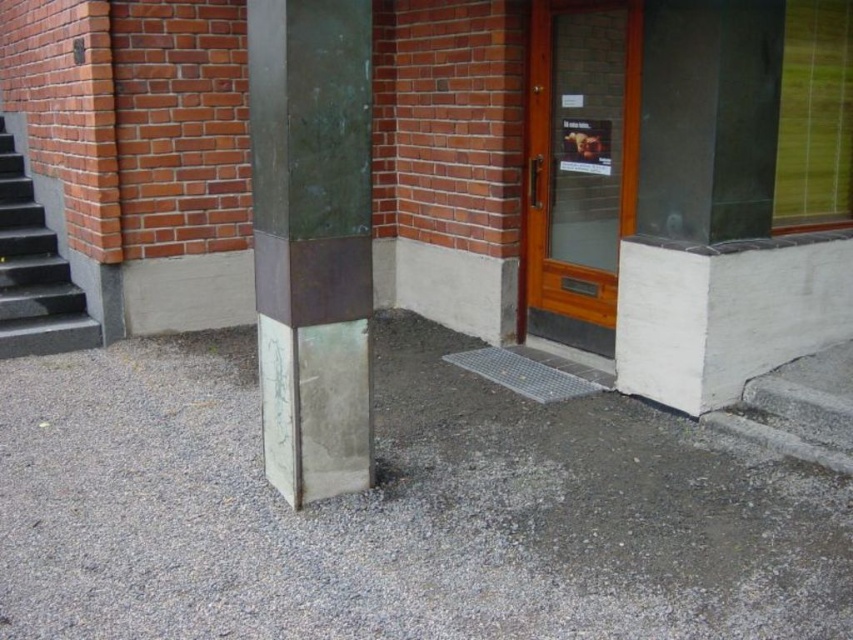
Question: Among these points, which one is nearest to the camera?

Choices:
 (A) (341, 480)
 (B) (35, 216)

Answer: (A)

Question: Considering the relative positions of green polished stone pillar at center and black polished concrete stairs at left in the image provided, where is green polished stone pillar at center located with respect to black polished concrete stairs at left?

Choices:
 (A) above
 (B) below

Answer: (A)

Question: Estimate the real-world distances between objects in this image. Which object is farther from the green polished stone pillar at center?

Choices:
 (A) black polished concrete stairs at left
 (B) wooden door at center

Answer: (A)

Question: Which of these objects is positioned farthest from the wooden door at center?

Choices:
 (A) black polished concrete stairs at left
 (B) green polished stone pillar at center

Answer: (A)

Question: Can you confirm if green polished stone pillar at center is positioned below black polished concrete stairs at left?

Choices:
 (A) no
 (B) yes

Answer: (A)

Question: Is green polished stone pillar at center further to the viewer compared to wooden door at center?

Choices:
 (A) yes
 (B) no

Answer: (B)